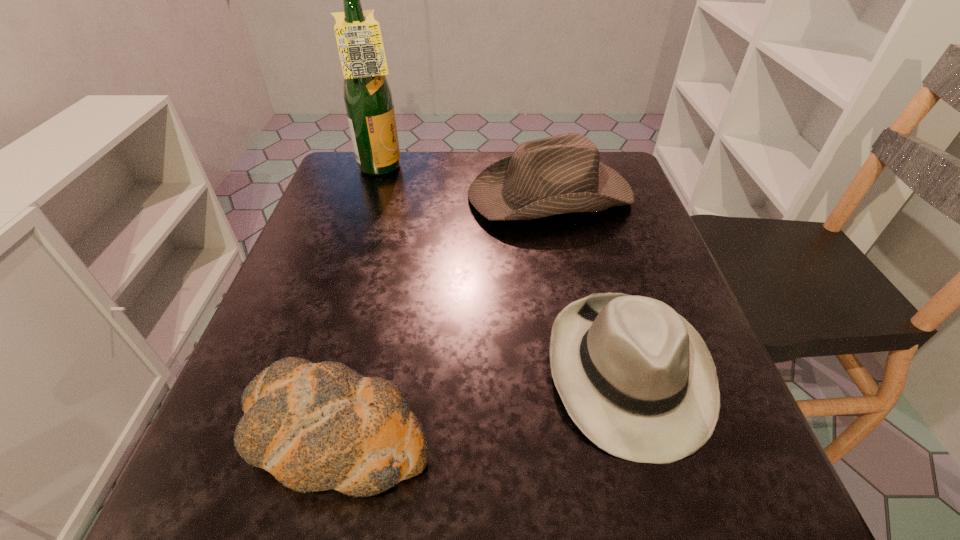
The height and width of the screenshot is (540, 960). What are the coordinates of `vacant point that satisfies the following two spatial constraints: 1. on the front-facing side of the second tallest object; 2. on the right side of the liquor` in the screenshot? It's located at (373, 194).